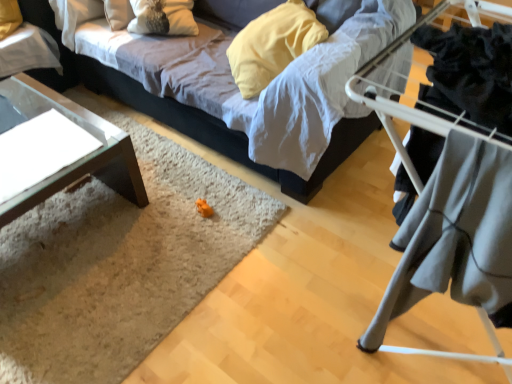
Question: Considering the relative sizes of velvet fabric couch at center and clear glass table at upper left, the second table positioned from the bottom, in the image provided, is velvet fabric couch at center wider than clear glass table at upper left, the second table positioned from the bottom,?

Choices:
 (A) yes
 (B) no

Answer: (A)

Question: Is velvet fabric couch at center thinner than clear glass table at upper left, arranged as the 1th table when viewed from the top?

Choices:
 (A) no
 (B) yes

Answer: (A)

Question: Is velvet fabric couch at center surrounding clear glass table at upper left, arranged as the 1th table when viewed from the top?

Choices:
 (A) no
 (B) yes

Answer: (A)

Question: Does velvet fabric couch at center have a larger size compared to clear glass table at upper left, the second table positioned from the bottom?

Choices:
 (A) yes
 (B) no

Answer: (A)

Question: Is velvet fabric couch at center completely or partially outside of clear glass table at upper left, the second table positioned from the bottom?

Choices:
 (A) no
 (B) yes

Answer: (B)

Question: In terms of size, does velvet fabric couch at center appear bigger or smaller than clear glass table at upper left, the second table positioned from the bottom?

Choices:
 (A) small
 (B) big

Answer: (B)

Question: In terms of width, does velvet fabric couch at center look wider or thinner when compared to clear glass table at upper left, the second table positioned from the bottom?

Choices:
 (A) thin
 (B) wide

Answer: (B)

Question: From the image's perspective, is velvet fabric couch at center positioned above or below clear glass table at upper left, arranged as the 1th table when viewed from the top?

Choices:
 (A) above
 (B) below

Answer: (B)

Question: Considering the positions of point (146, 67) and point (32, 49), is point (146, 67) closer or farther from the camera than point (32, 49)?

Choices:
 (A) closer
 (B) farther

Answer: (A)

Question: Do you think gray fabric at right is within clear glass table at upper left, arranged as the 1th table when viewed from the top, or outside of it?

Choices:
 (A) inside
 (B) outside

Answer: (B)

Question: From a real-world perspective, is gray fabric at right above or below clear glass table at upper left, the second table positioned from the bottom?

Choices:
 (A) above
 (B) below

Answer: (A)

Question: Considering their positions, is gray fabric at right located in front of or behind clear glass table at upper left, arranged as the 1th table when viewed from the top?

Choices:
 (A) front
 (B) behind

Answer: (A)

Question: From the image's perspective, is gray fabric at right located above or below clear glass table at upper left, arranged as the 1th table when viewed from the top?

Choices:
 (A) above
 (B) below

Answer: (B)

Question: Considering their positions, is gray fabric at right located in front of or behind velvet fabric couch at center?

Choices:
 (A) behind
 (B) front

Answer: (B)

Question: Considering the positions of point [x=437, y=122] and point [x=374, y=125], is point [x=437, y=122] closer or farther from the camera than point [x=374, y=125]?

Choices:
 (A) closer
 (B) farther

Answer: (A)